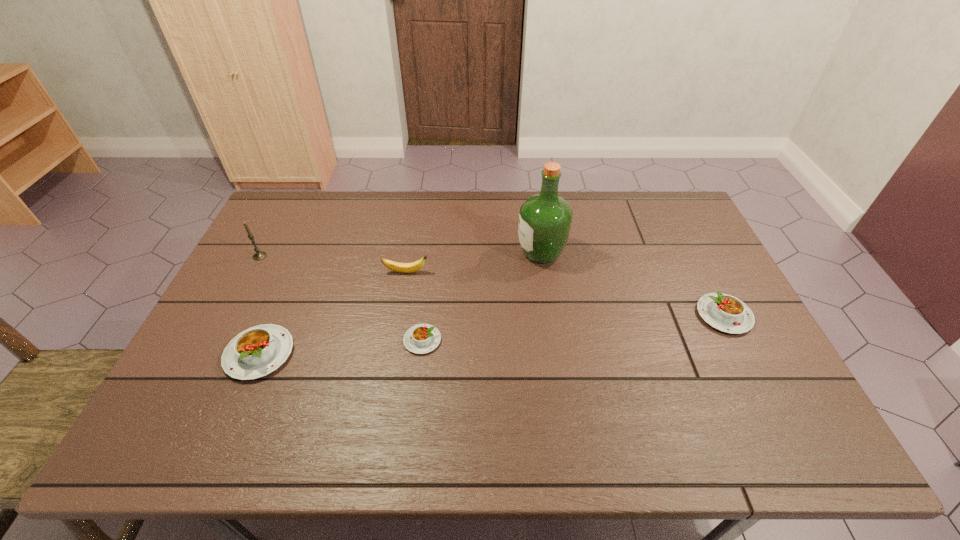
Choose which pudding is the second nearest neighbor to the shortest object. Please provide its 2D coordinates. Your answer should be formatted as a tuple, i.e. [(x, y)], where the tuple contains the x and y coordinates of a point satisfying the conditions above.

[(726, 313)]

Where is `pudding that stands as the second closest to the rightmost object`? This screenshot has width=960, height=540. pudding that stands as the second closest to the rightmost object is located at coordinates (256, 352).

Find the location of `vacant area that satisfies the following two spatial constraints: 1. on the front-facing side of the liquor; 2. on the front side of the shortest pudding`. vacant area that satisfies the following two spatial constraints: 1. on the front-facing side of the liquor; 2. on the front side of the shortest pudding is located at coordinates (554, 340).

What are the coordinates of `vacant space that satisfies the following two spatial constraints: 1. at the stem of the banana; 2. on the left side of the rightmost pudding` in the screenshot? It's located at pyautogui.click(x=399, y=315).

The height and width of the screenshot is (540, 960). I want to click on vacant space that satisfies the following two spatial constraints: 1. on the back side of the rightmost pudding; 2. on the front-facing side of the tallest object, so click(692, 253).

At what (x,y) coordinates should I click in order to perform the action: click on free spot that satisfies the following two spatial constraints: 1. on the front-facing side of the liquor; 2. on the front side of the shortest object. Please return your answer as a coordinate pair (x, y). The image size is (960, 540). Looking at the image, I should click on (554, 340).

Where is `vacant area in the image that satisfies the following two spatial constraints: 1. at the stem of the second pudding from right to left; 2. on the right side of the fourth nearest object`? The width and height of the screenshot is (960, 540). vacant area in the image that satisfies the following two spatial constraints: 1. at the stem of the second pudding from right to left; 2. on the right side of the fourth nearest object is located at coordinates tap(395, 340).